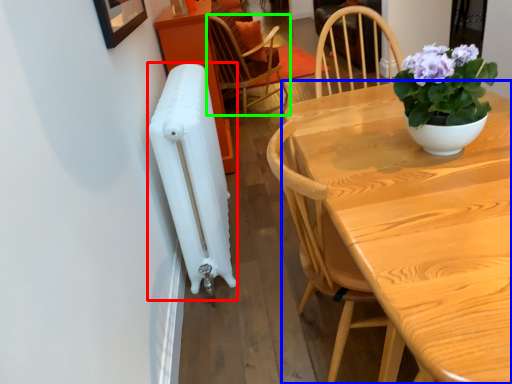
Question: Based on their relative distances, which object is nearer to radiator (highlighted by a red box)? Choose from table (highlighted by a blue box) and chair (highlighted by a green box).

Choices:
 (A) table
 (B) chair

Answer: (A)